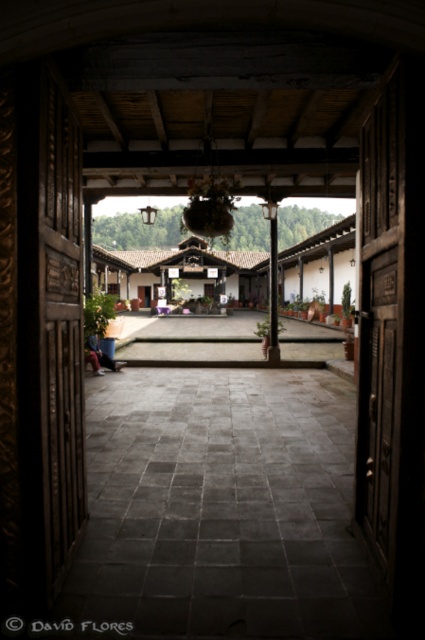
Based on the photo, you are a delivery person holding a 2.5 meter long ladder. You need to carry it through the dark brown wooden door at left into the courtyard. Can you fit the ladder through the doorway?

The distance between the dark brown wooden door at left and the camera is 2.47 meters. Since the ladder is 2.5 meters long, it is slightly longer than the available space, so it won not fit through the doorway.

Consider the image. You are a delivery person carrying a large package that is 1 meter wide. You need to walk through the courtyard from the dark brown wooden door at left to the smooth stone pillar at center. Is there enough space for you to pass through without hitting the door or pillar?

The distance between the dark brown wooden door at left and the smooth stone pillar at center is 8.73 meters. Since your package is only 1 meter wide, there is ample space to pass through without any issues.